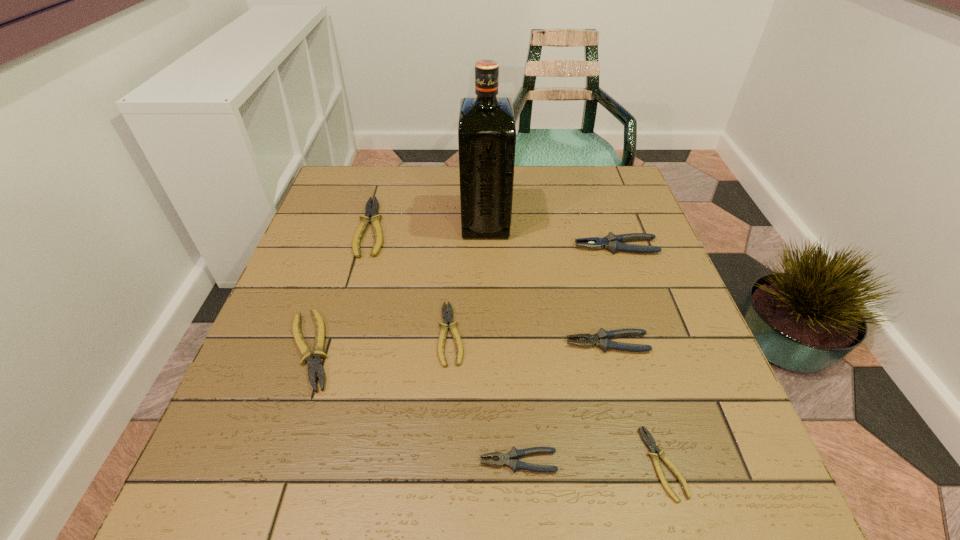
Locate an element on the screen. vacant area situated at the gripping part of the second biggest gray pliers is located at coordinates (537, 343).

You are a GUI agent. You are given a task and a screenshot of the screen. Output one action in this format:
    pyautogui.click(x=<x>, y=<y>)
    Task: Click on the vacant space situated 0.160m on the back of the farthest yellow pliers
    Image resolution: width=960 pixels, height=540 pixels.
    Given the screenshot: What is the action you would take?
    pyautogui.click(x=388, y=172)

I want to click on free space located on the right of the third smallest yellow pliers, so click(479, 350).

Locate an element on the screen. This screenshot has width=960, height=540. vacant space located 0.190m at the gripping part of the smallest gray pliers is located at coordinates (366, 461).

At what (x,y) coordinates should I click in order to perform the action: click on blank space located 0.080m at the gripping part of the smallest gray pliers. Please return your answer as a coordinate pair (x, y). This screenshot has height=540, width=960. Looking at the image, I should click on click(x=432, y=461).

Image resolution: width=960 pixels, height=540 pixels. In order to click on free space located 0.120m at the gripping part of the smallest gray pliers in this screenshot , I will do `click(408, 461)`.

Where is `vacant position located 0.070m on the left of the third yellow pliers from left to right`? The width and height of the screenshot is (960, 540). vacant position located 0.070m on the left of the third yellow pliers from left to right is located at coordinates (405, 334).

The height and width of the screenshot is (540, 960). Find the location of `free space located 0.260m on the back of the nearest yellow pliers`. free space located 0.260m on the back of the nearest yellow pliers is located at coordinates (619, 316).

Locate an element on the screen. Image resolution: width=960 pixels, height=540 pixels. liquor situated at the far edge is located at coordinates (486, 133).

Where is `pliers that is at the far edge`? The width and height of the screenshot is (960, 540). pliers that is at the far edge is located at coordinates (371, 212).